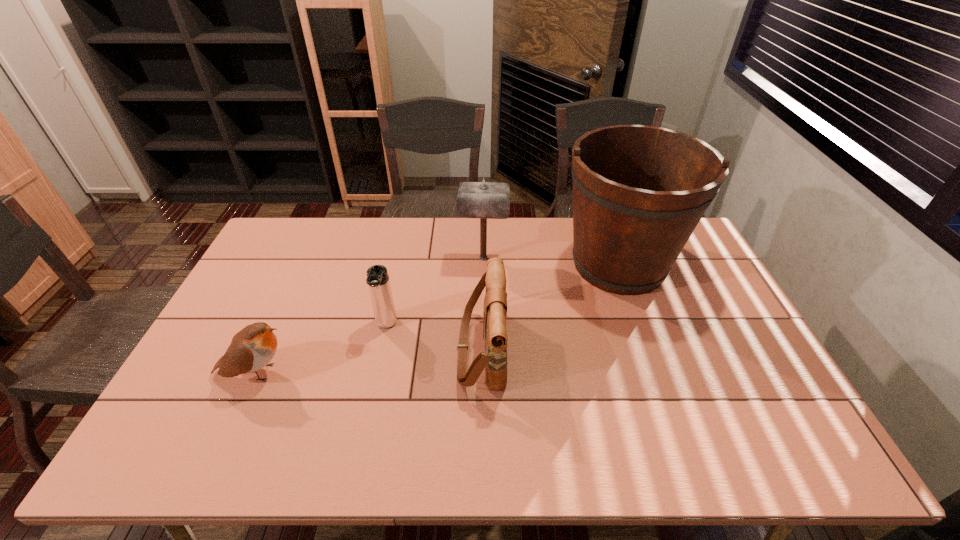
Where is `vacant space situated 0.120m on the front-facing side of the shoulder bag`? This screenshot has height=540, width=960. vacant space situated 0.120m on the front-facing side of the shoulder bag is located at coordinates (415, 349).

The height and width of the screenshot is (540, 960). What are the coordinates of `vacant area located 0.190m on the handle side of the thermos bottle` in the screenshot? It's located at (372, 394).

The image size is (960, 540). I want to click on vacant area located at the face of the bird, so click(319, 373).

I want to click on bucket that is at the far edge, so click(x=639, y=191).

Where is `mallet situated at the far edge`? Image resolution: width=960 pixels, height=540 pixels. mallet situated at the far edge is located at coordinates (486, 200).

Locate an element on the screen. This screenshot has height=540, width=960. object located in the left edge section of the desktop is located at coordinates (252, 348).

The width and height of the screenshot is (960, 540). In order to click on object positioned at the right edge in this screenshot , I will do coord(639,191).

Identify the location of object located at the far right corner. This screenshot has height=540, width=960. (639, 191).

The height and width of the screenshot is (540, 960). In order to click on blank space at the far edge in this screenshot , I will do `click(467, 238)`.

The width and height of the screenshot is (960, 540). In the image, there is a desktop. Identify the location of vacant space at the near edge. (219, 466).